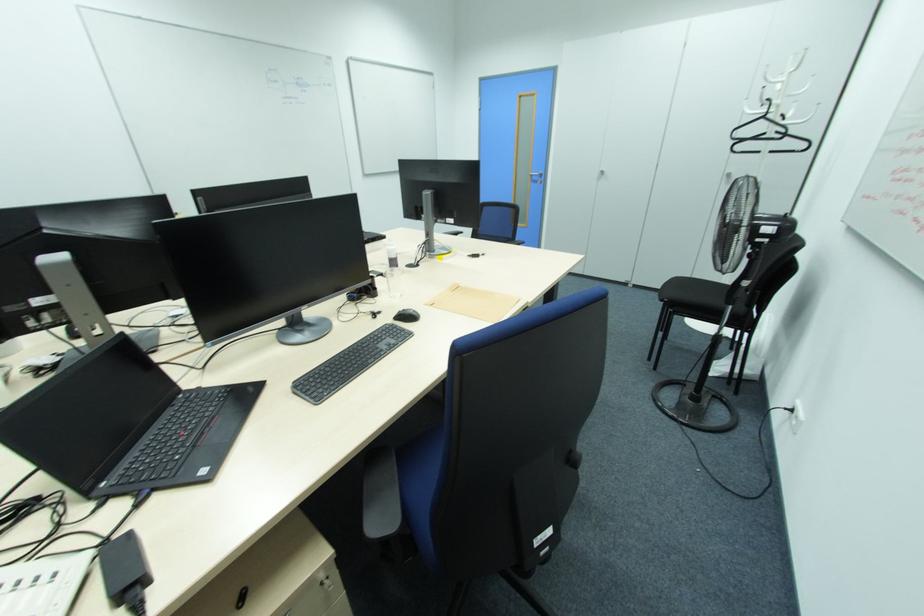
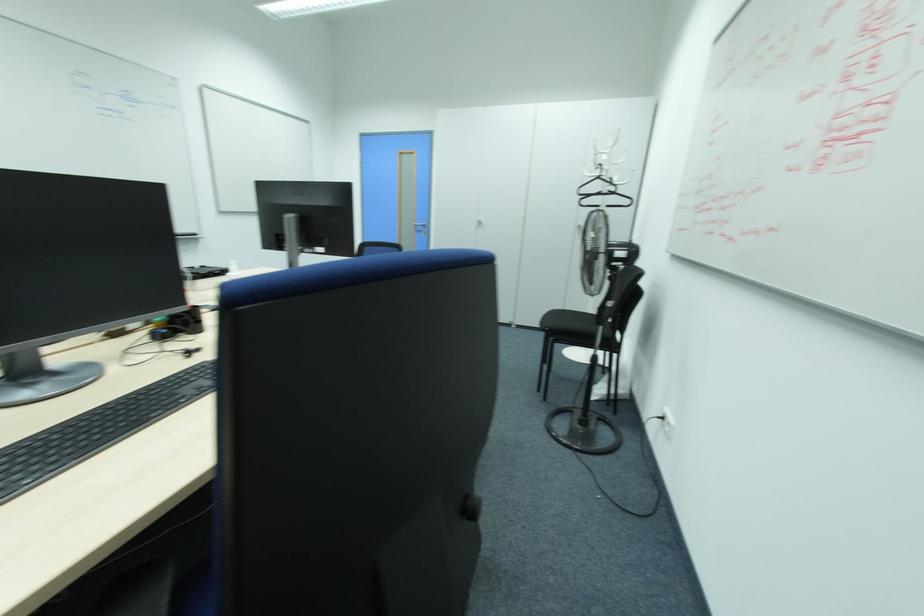
Where in the second image is the point corresponding to (688,277) from the first image?

(562, 309)